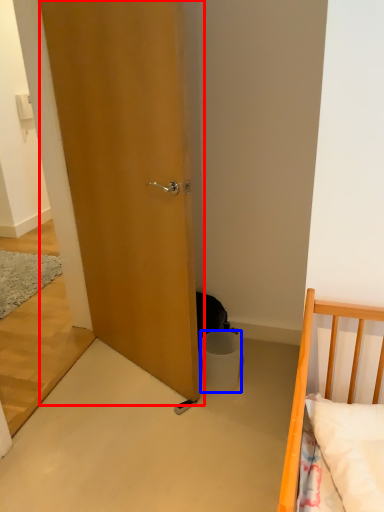
Question: Which point is further to the camera, door (highlighted by a red box) or trash bin/can (highlighted by a blue box)?

Choices:
 (A) door
 (B) trash bin/can

Answer: (B)